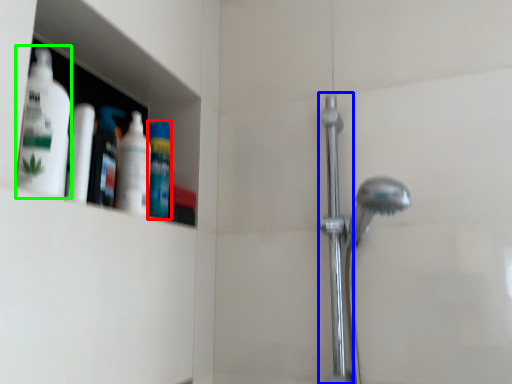
Question: Estimate the real-world distances between objects in this image. Which object is closer to mouthwash (highlighted by a red box), shower door (highlighted by a blue box) or cleaning product (highlighted by a green box)?

Choices:
 (A) shower door
 (B) cleaning product

Answer: (B)